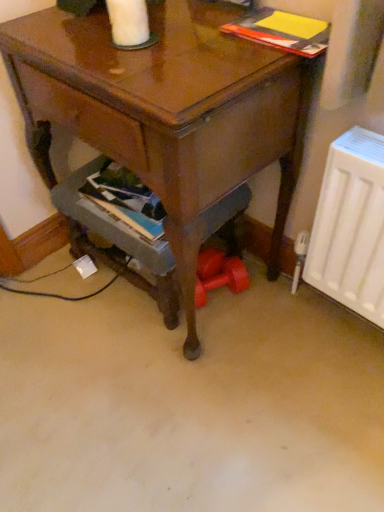
This screenshot has width=384, height=512. What are the coordinates of `free location above shiny brown desk at center (from a real-world perspective)` in the screenshot? It's located at (152, 38).